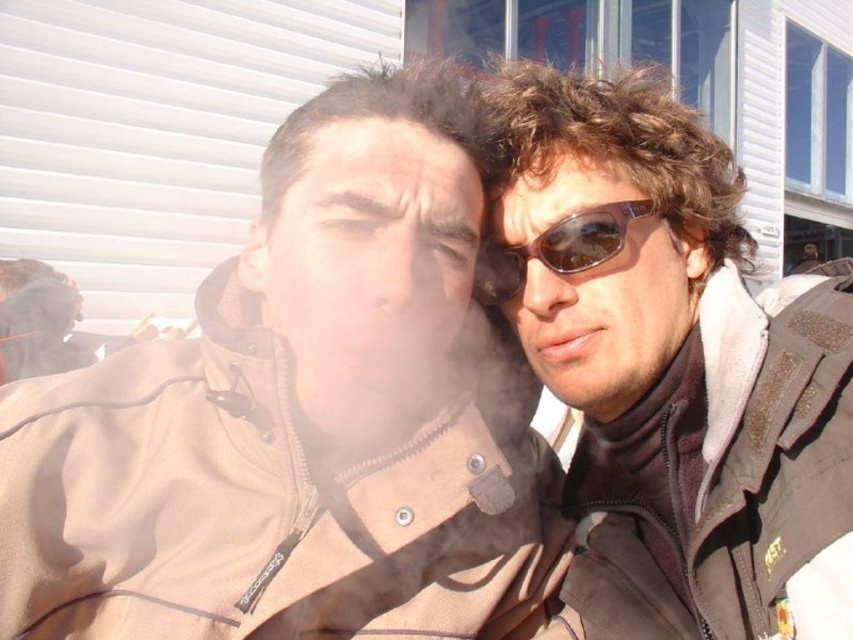
Question: Which point is farther to the camera?

Choices:
 (A) sunglasses at right
 (B) brown reflective sunglasses at right
 (C) brown soft jacket at center

Answer: (B)

Question: Does brown soft jacket at center come in front of brown reflective sunglasses at right?

Choices:
 (A) no
 (B) yes

Answer: (B)

Question: Considering the real-world distances, which object is farthest from the sunglasses at right?

Choices:
 (A) brown soft jacket at center
 (B) brown reflective sunglasses at right

Answer: (A)

Question: Is brown soft jacket at center thinner than brown reflective sunglasses at right?

Choices:
 (A) no
 (B) yes

Answer: (A)

Question: From the image, what is the correct spatial relationship of brown soft jacket at center in relation to sunglasses at right?

Choices:
 (A) left
 (B) right

Answer: (A)

Question: Which object appears closest to the camera in this image?

Choices:
 (A) brown soft jacket at center
 (B) brown reflective sunglasses at right

Answer: (A)